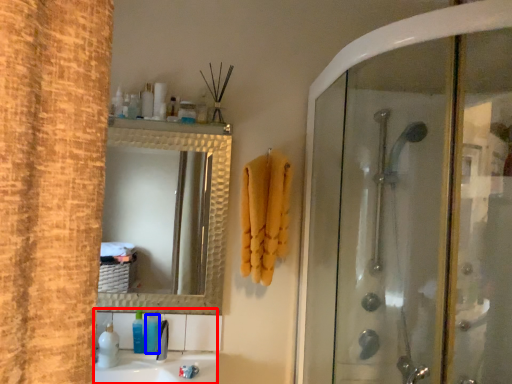
Question: Which object appears farthest to the camera in this image, sink (highlighted by a red box) or toiletry (highlighted by a blue box)?

Choices:
 (A) sink
 (B) toiletry

Answer: (B)